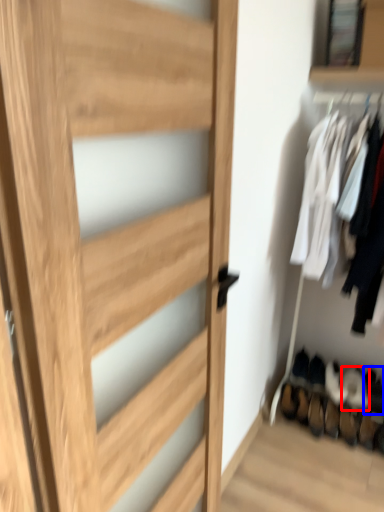
Question: Which object appears farthest to the camera in this image, shoe (highlighted by a red box) or shoe (highlighted by a blue box)?

Choices:
 (A) shoe
 (B) shoe

Answer: (B)